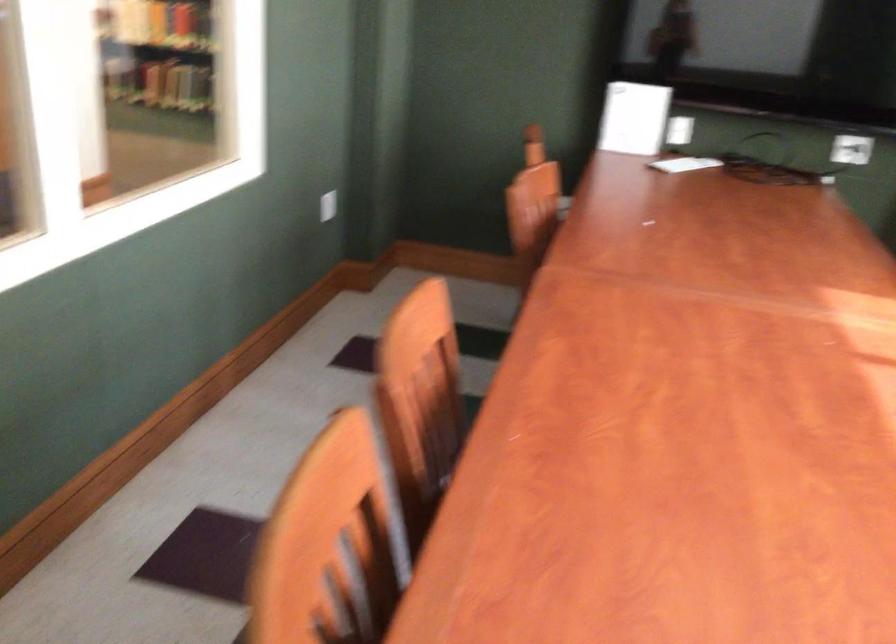
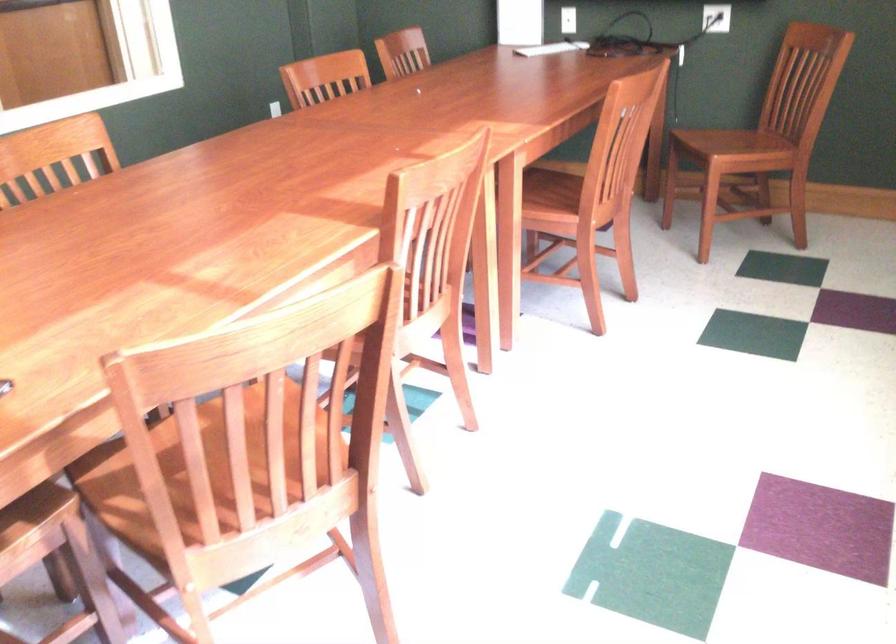
Question: In a continuous first-person perspective shot, in which direction is the camera moving?

Choices:
 (A) Left
 (B) Right
 (C) Forward
 (D) Backward

Answer: (B)